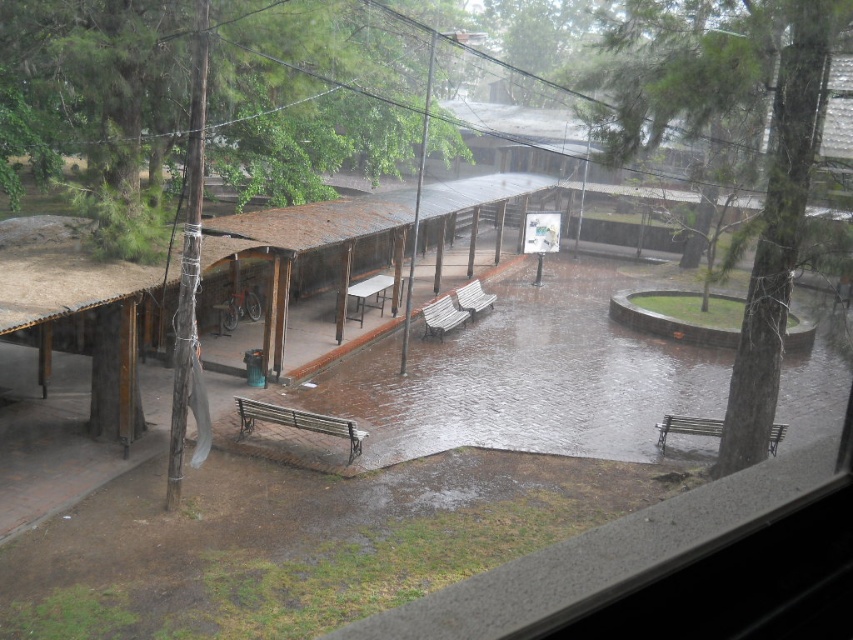
Can you confirm if rustic wood bench at lower center is positioned to the left of wooden bench at lower right?

Correct, you'll find rustic wood bench at lower center to the left of wooden bench at lower right.

Which is behind, point (283, 406) or point (670, 426)?

Positioned behind is point (670, 426).

Which is in front, point (328, 420) or point (665, 432)?

Positioned in front is point (328, 420).

What are the coordinates of `rustic wood bench at lower center` in the screenshot? It's located at (299, 422).

Does point (601, 276) come in front of point (660, 440)?

No, (601, 276) is further to viewer.

From the picture: Which of these two, wet concrete benches at center or wooden bench at lower right, stands shorter?

With less height is wooden bench at lower right.

Measure the distance between wet concrete benches at center and camera.

The distance of wet concrete benches at center from camera is 43.08 feet.

Find the location of a particular element. wet concrete benches at center is located at coordinates (527, 376).

Can you confirm if rusty metal shelter at center is wider than wooden bench at center?

Correct, the width of rusty metal shelter at center exceeds that of wooden bench at center.

Does rusty metal shelter at center appear under wooden bench at center?

No.

This screenshot has height=640, width=853. I want to click on rusty metal shelter at center, so tap(318, 221).